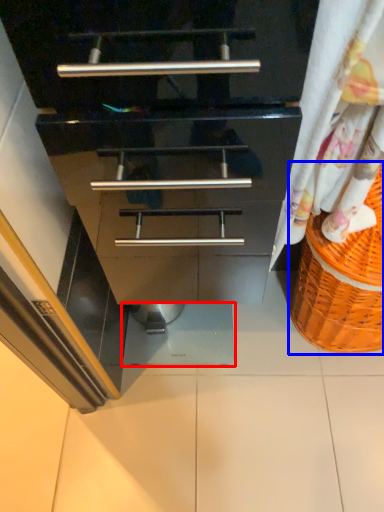
Question: Among these objects, which one is farthest to the camera, tile (highlighted by a red box) or basket (highlighted by a blue box)?

Choices:
 (A) tile
 (B) basket

Answer: (A)